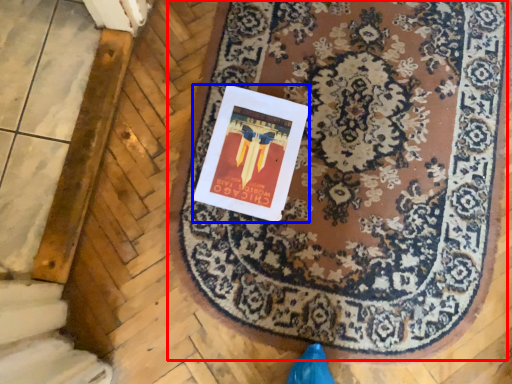
Question: Which point is further to the camera, mat (highlighted by a red box) or postcard (highlighted by a blue box)?

Choices:
 (A) mat
 (B) postcard

Answer: (B)